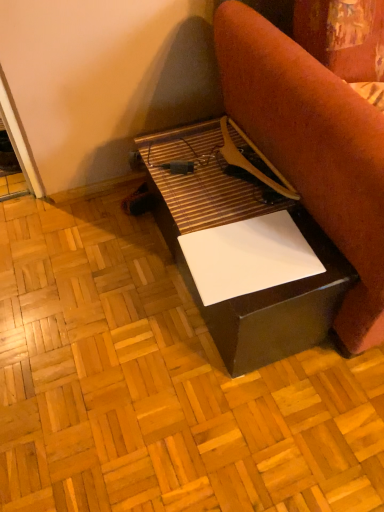
Identify the location of free location above matte black table at center (from a real-world perspective). This screenshot has width=384, height=512. (224, 190).